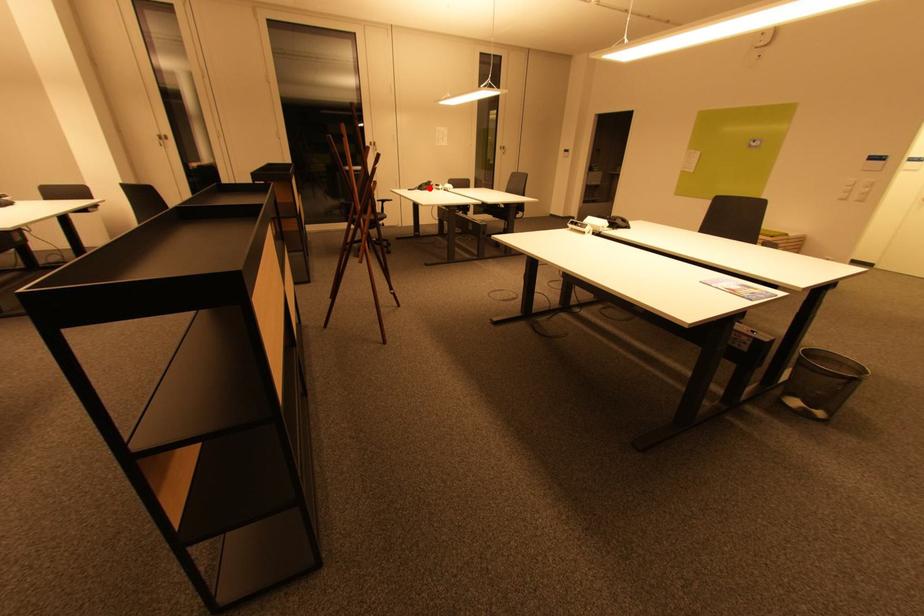
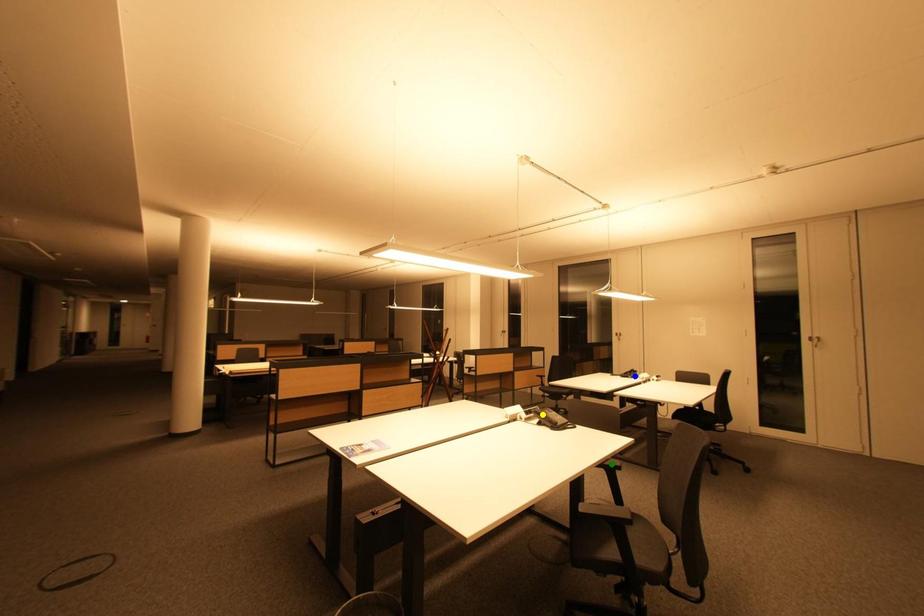
Question: I am providing you with two images of the same scene from different viewpoints. A red point is marked on the first image. You are given multiple points on the second image. Can you choose the point in image 2 that corresponds to the point in image 1?

Choices:
 (A) green point
 (B) yellow point
 (C) blue point

Answer: (C)